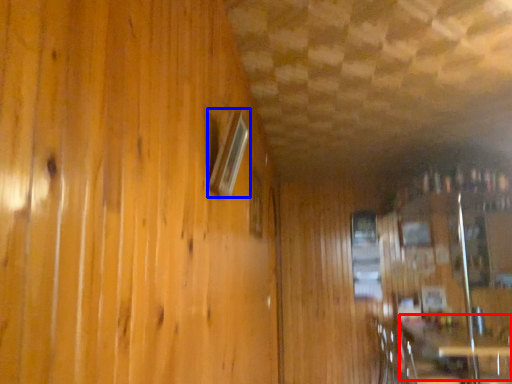
Question: Which of the following is the closest to the observer, table (highlighted by a red box) or window (highlighted by a blue box)?

Choices:
 (A) table
 (B) window

Answer: (B)